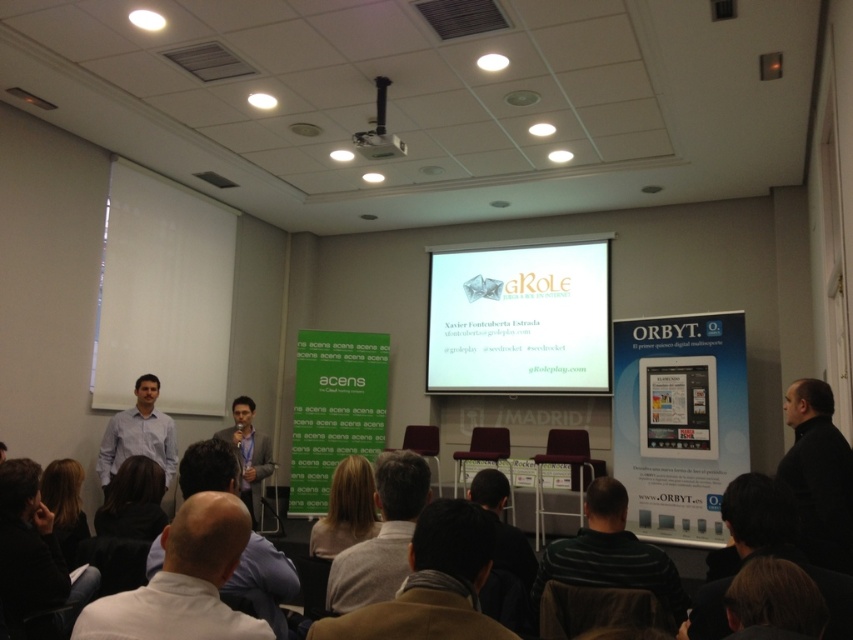
You are a photographer standing at the back of the room and want to take a clear photo of the white glossy projection screen at center. However, there is a person wearing a black fabric shirt at lower center in your way. Can you adjust your position to avoid the person while still capturing the screen?

The white glossy projection screen at center is further to the viewer than the black fabric shirt at lower center. By moving to the side, you can position yourself so that the person is no longer blocking your view of the screen.

You are standing at the entrance of the conference room and see the point marked at coordinates (505, 557). What object is located at that point?

The point at coordinates (505, 557) marks the location of the black fabric shirt at lower center.

You are standing at the entrance of the conference room and want to approach the striped sweater at center and the dark brown hair at lower left. Which one would you reach first if you walk straight ahead?

The striped sweater at center is 7.35 feet away from dark brown hair at lower left. Since you are walking straight ahead, you would reach the dark brown hair at lower left first because it is closer to you than the striped sweater at center.